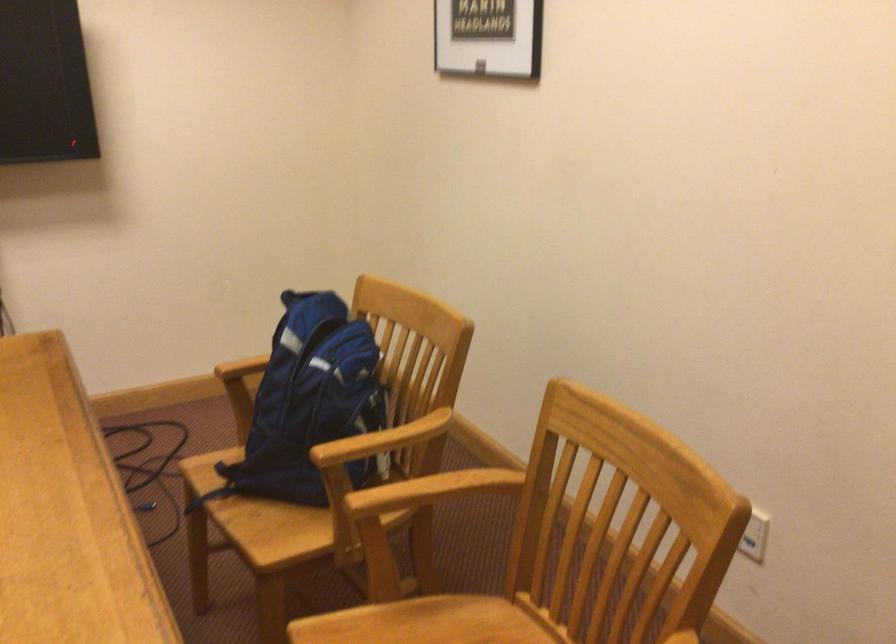
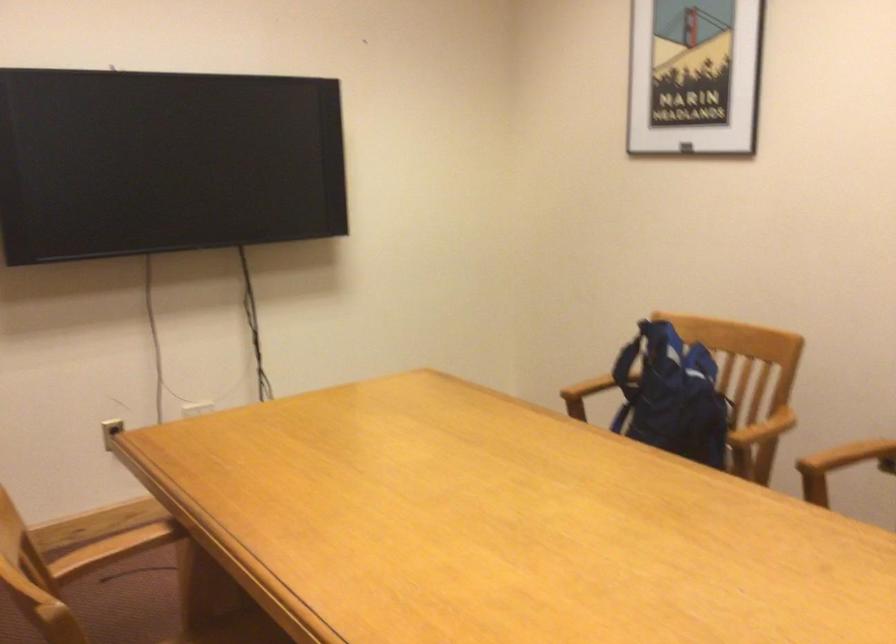
Question: What movement of the cameraman would produce the second image?

Choices:
 (A) Left
 (B) Right
 (C) Forward
 (D) Backward

Answer: (A)